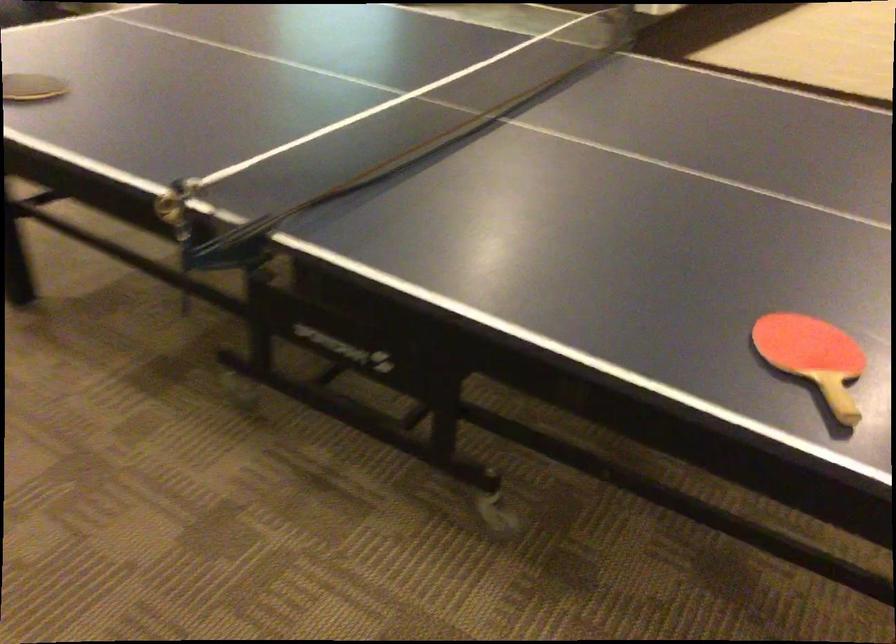
Describe the element at coordinates (488, 494) in the screenshot. I see `the table caster wheel` at that location.